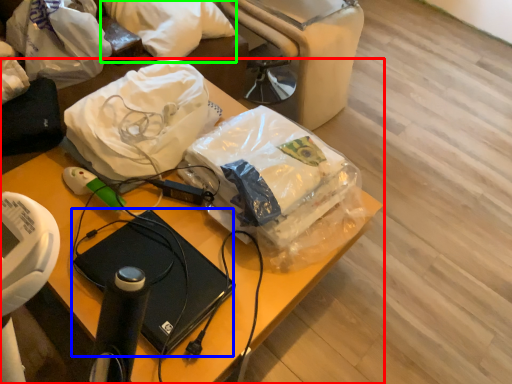
Question: Considering the real-world distances, which object is closest to furniture (highlighted by a red box)? computer (highlighted by a blue box) or pillow (highlighted by a green box).

Choices:
 (A) computer
 (B) pillow

Answer: (A)